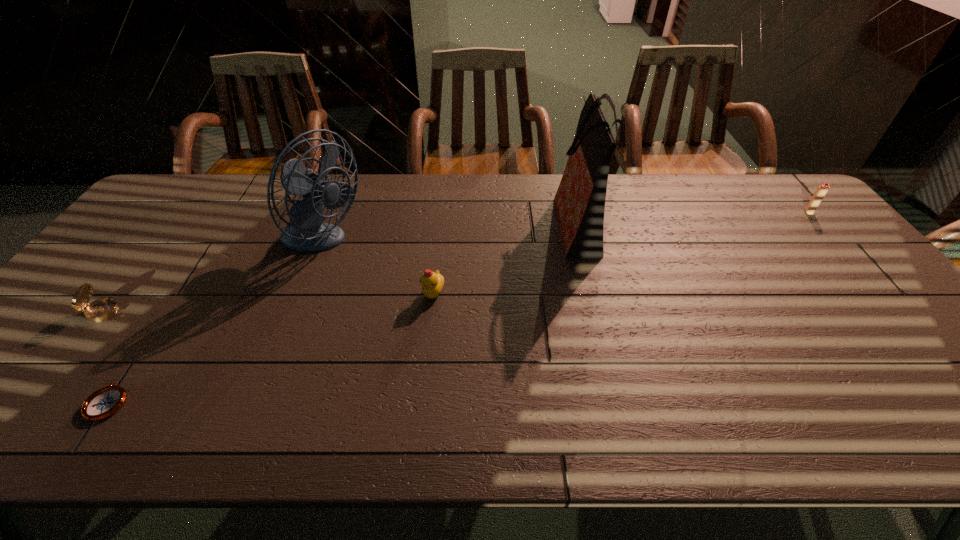
The image size is (960, 540). I want to click on free space located 0.250m on the front side of the second object from right to left, so click(473, 222).

At what (x,y) coordinates should I click in order to perform the action: click on free region located in front of the fan to blow air. Please return your answer as a coordinate pair (x, y). Looking at the image, I should click on (468, 244).

Locate an element on the screen. This screenshot has width=960, height=540. vacant space situated on the left of the igniter is located at coordinates (763, 212).

In order to click on free space located on the front-facing side of the third object from right to left in this screenshot , I will do `click(420, 427)`.

In order to click on vacant position located with the dial facing the leftmost object in this screenshot , I will do `click(203, 312)`.

At what (x,y) coordinates should I click in order to perform the action: click on vacant space located 0.230m on the back of the nearest object. Please return your answer as a coordinate pair (x, y). The width and height of the screenshot is (960, 540). Looking at the image, I should click on (172, 305).

Where is `shopping bag located in the far edge section of the desktop`? This screenshot has width=960, height=540. shopping bag located in the far edge section of the desktop is located at coordinates (580, 199).

Image resolution: width=960 pixels, height=540 pixels. I want to click on igniter situated at the far edge, so (821, 191).

Identify the location of object that is positioned at the near edge. (103, 403).

Locate an element on the screen. object present at the left edge is located at coordinates (102, 309).